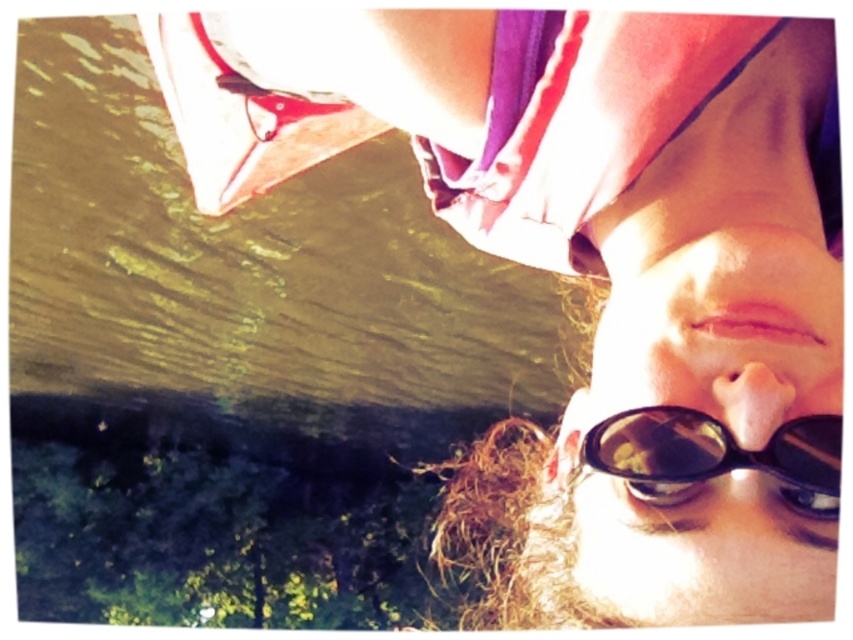
Question: Is purple silky headscarf at upper center positioned in front of black matte sunglasses at lower center?

Choices:
 (A) no
 (B) yes

Answer: (A)

Question: Is the position of purple silky headscarf at upper center less distant than that of black matte sunglasses at lower center?

Choices:
 (A) no
 (B) yes

Answer: (A)

Question: Which of the following is the closest to the observer?

Choices:
 (A) purple silky headscarf at upper center
 (B) black matte sunglasses at lower center

Answer: (B)

Question: Can you confirm if purple silky headscarf at upper center is positioned to the left of black matte sunglasses at lower center?

Choices:
 (A) yes
 (B) no

Answer: (A)